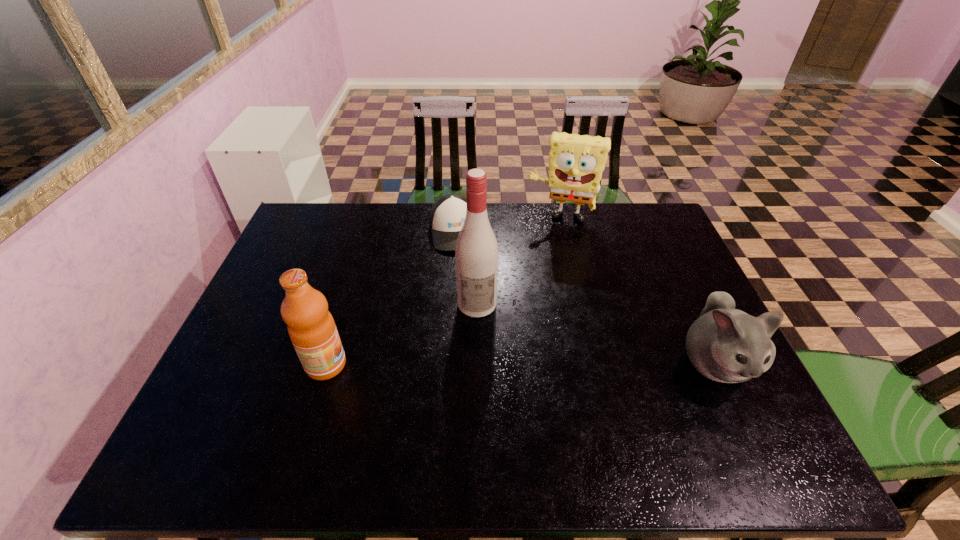
The height and width of the screenshot is (540, 960). In order to click on free space between the fruit juice and the tallest object in this screenshot , I will do `click(401, 334)`.

Image resolution: width=960 pixels, height=540 pixels. I want to click on blank region between the cap and the sponge, so click(x=508, y=225).

This screenshot has height=540, width=960. I want to click on free point between the cap and the leftmost object, so click(x=391, y=298).

This screenshot has width=960, height=540. Find the location of `empty space between the cap and the leftmost object`. empty space between the cap and the leftmost object is located at coordinates (391, 298).

You are a GUI agent. You are given a task and a screenshot of the screen. Output one action in this format:
    pyautogui.click(x=<x>, y=<y>)
    Task: Click on the vacant space in between the cap and the sponge
    This screenshot has width=960, height=540.
    Given the screenshot: What is the action you would take?
    click(508, 225)

Find the location of `unoccupied area between the sponge and the fruit juice`. unoccupied area between the sponge and the fruit juice is located at coordinates (444, 292).

The image size is (960, 540). I want to click on vacant area that lies between the shortest object and the second object from right to left, so click(x=508, y=225).

Point out which object is positioned as the third nearest to the hamster. Please provide its 2D coordinates. Your answer should be formatted as a tuple, i.e. [(x, y)], where the tuple contains the x and y coordinates of a point satisfying the conditions above.

[(448, 213)]

Select which object appears as the second closest to the sponge. Please provide its 2D coordinates. Your answer should be formatted as a tuple, i.e. [(x, y)], where the tuple contains the x and y coordinates of a point satisfying the conditions above.

[(476, 252)]